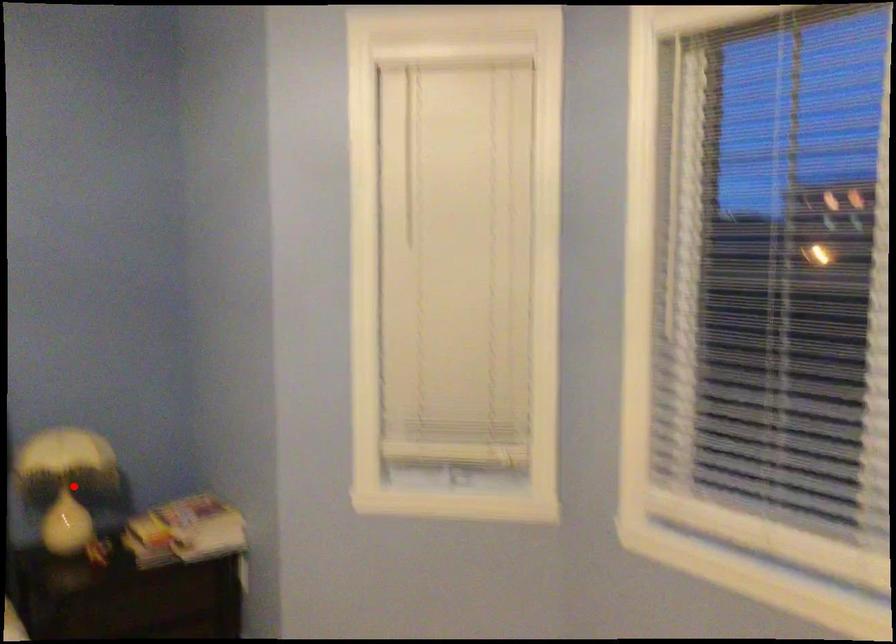
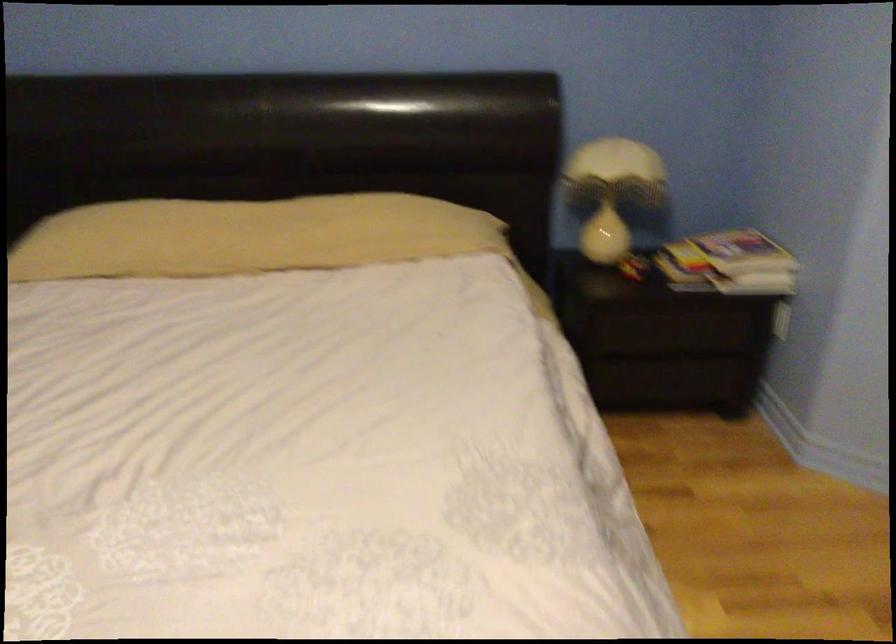
Question: I am providing you with two images of the same scene from different viewpoints. A red point is shown in image1. For the corresponding object point in image2, is it positioned nearer or farther from the camera?

Choices:
 (A) Nearer
 (B) Farther

Answer: (A)